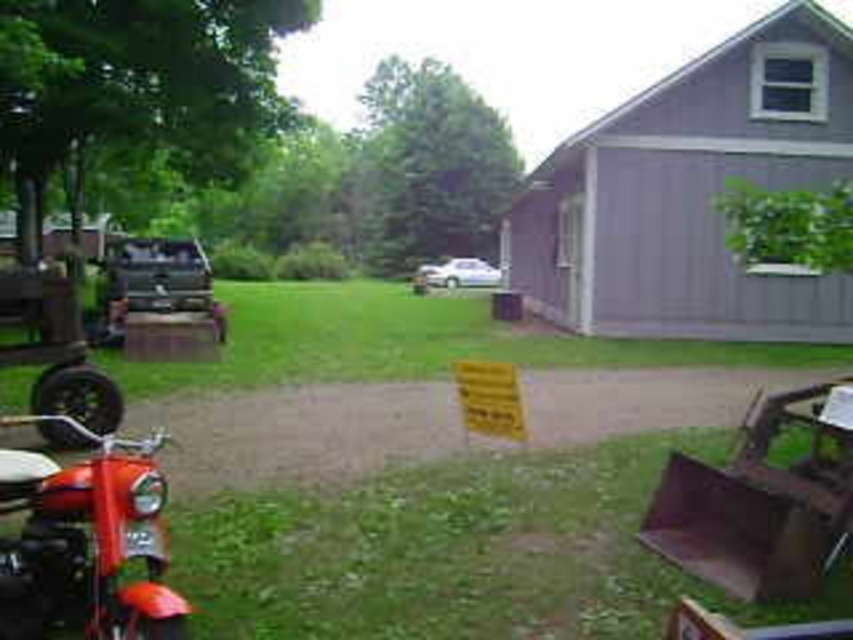
Who is lower down, purple woodshed at upper right or shiny red motorcycle at lower left?

shiny red motorcycle at lower left

Does point (625, 157) come farther from viewer compared to point (56, 502)?

Yes, point (625, 157) is behind point (56, 502).

Who is more distant from viewer, (x=630, y=280) or (x=102, y=467)?

The point (x=630, y=280) is behind.

Locate an element on the screen. This screenshot has width=853, height=640. purple woodshed at upper right is located at coordinates (691, 193).

Does purple woodshed at upper right lie in front of smooth concrete driveway at center?

That is False.

Is purple woodshed at upper right positioned behind smooth concrete driveway at center?

Yes, it is behind smooth concrete driveway at center.

At what (x,y) coordinates should I click in order to perform the action: click on purple woodshed at upper right. Please return your answer as a coordinate pair (x, y). Looking at the image, I should click on [691, 193].

Image resolution: width=853 pixels, height=640 pixels. I want to click on purple woodshed at upper right, so click(x=691, y=193).

Is smooth concrete driveway at center further to the viewer compared to shiny red motorcycle at lower left?

Yes, smooth concrete driveway at center is further from the viewer.

Find the location of a particular element. smooth concrete driveway at center is located at coordinates (300, 433).